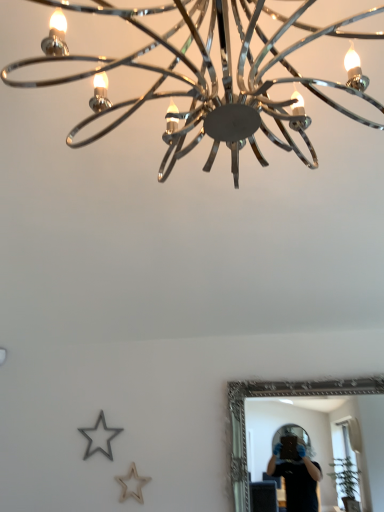
What do you see at coordinates (211, 78) in the screenshot? Image resolution: width=384 pixels, height=512 pixels. I see `chrome/metallic chandelier at upper center` at bounding box center [211, 78].

Locate an element on the screen. chrome/metallic chandelier at upper center is located at coordinates (211, 78).

The image size is (384, 512). What do you see at coordinates (323, 438) in the screenshot? I see `silver/golden metallic mirror at lower right` at bounding box center [323, 438].

Measure the distance between point (381, 395) and camera.

Point (381, 395) and camera are 7.97 feet apart.

The width and height of the screenshot is (384, 512). I want to click on silver/golden metallic mirror at lower right, so click(x=323, y=438).

Find the location of a particular element. The width and height of the screenshot is (384, 512). chrome/metallic chandelier at upper center is located at coordinates (211, 78).

Considering the relative positions of chrome/metallic chandelier at upper center and silver/golden metallic mirror at lower right in the image provided, is chrome/metallic chandelier at upper center to the left or to the right of silver/golden metallic mirror at lower right?

In the image, chrome/metallic chandelier at upper center appears on the left side of silver/golden metallic mirror at lower right.

Considering the positions of objects chrome/metallic chandelier at upper center and silver/golden metallic mirror at lower right in the image provided, who is behind, chrome/metallic chandelier at upper center or silver/golden metallic mirror at lower right?

silver/golden metallic mirror at lower right is further away from the camera.

Is point (29, 64) farther from viewer compared to point (305, 414)?

That is False.

From the image's perspective, is chrome/metallic chandelier at upper center located above or below silver/golden metallic mirror at lower right?

From the image's perspective, chrome/metallic chandelier at upper center appears above silver/golden metallic mirror at lower right.

From a real-world perspective, is chrome/metallic chandelier at upper center below silver/golden metallic mirror at lower right?

No, from a real-world perspective, chrome/metallic chandelier at upper center is not below silver/golden metallic mirror at lower right.

Which of these two, chrome/metallic chandelier at upper center or silver/golden metallic mirror at lower right, is wider?

With larger width is chrome/metallic chandelier at upper center.

In terms of height, does chrome/metallic chandelier at upper center look taller or shorter compared to silver/golden metallic mirror at lower right?

chrome/metallic chandelier at upper center is taller than silver/golden metallic mirror at lower right.

Between chrome/metallic chandelier at upper center and silver/golden metallic mirror at lower right, which one has smaller size?

With smaller size is silver/golden metallic mirror at lower right.

Is chrome/metallic chandelier at upper center surrounding silver/golden metallic mirror at lower right?

That's incorrect, silver/golden metallic mirror at lower right is not inside chrome/metallic chandelier at upper center.

Looking at this image, is chrome/metallic chandelier at upper center not near silver/golden metallic mirror at lower right?

Yes, chrome/metallic chandelier at upper center and silver/golden metallic mirror at lower right are quite far apart.

Consider the image. Is chrome/metallic chandelier at upper center facing towards silver/golden metallic mirror at lower right?

No, chrome/metallic chandelier at upper center is not aimed at silver/golden metallic mirror at lower right.

Find the location of a particular element. Image resolution: width=384 pixels, height=512 pixels. lamp located above the silver/golden metallic mirror at lower right (from the image's perspective) is located at coordinates (211, 78).

Does silver/golden metallic mirror at lower right appear on the left side of chrome/metallic chandelier at upper center?

No.

Does silver/golden metallic mirror at lower right come behind chrome/metallic chandelier at upper center?

That is True.

Which point is more forward, (361, 407) or (263, 102)?

The point (263, 102) is more forward.

From the image's perspective, would you say silver/golden metallic mirror at lower right is positioned over chrome/metallic chandelier at upper center?

No, from the image's perspective, silver/golden metallic mirror at lower right is not on top of chrome/metallic chandelier at upper center.

From a real-world perspective, is silver/golden metallic mirror at lower right positioned under chrome/metallic chandelier at upper center based on gravity?

Yes.

Which object is wider, silver/golden metallic mirror at lower right or chrome/metallic chandelier at upper center?

chrome/metallic chandelier at upper center.

Can you confirm if silver/golden metallic mirror at lower right is shorter than chrome/metallic chandelier at upper center?

Yes, silver/golden metallic mirror at lower right is shorter than chrome/metallic chandelier at upper center.

Which of these two, silver/golden metallic mirror at lower right or chrome/metallic chandelier at upper center, is bigger?

Bigger between the two is chrome/metallic chandelier at upper center.

Is silver/golden metallic mirror at lower right positioned beyond the bounds of chrome/metallic chandelier at upper center?

Yes.

Is silver/golden metallic mirror at lower right not near chrome/metallic chandelier at upper center?

Yes, silver/golden metallic mirror at lower right and chrome/metallic chandelier at upper center are quite far apart.

Is silver/golden metallic mirror at lower right aimed at chrome/metallic chandelier at upper center?

Yes.

Could you measure the distance between silver/golden metallic mirror at lower right and chrome/metallic chandelier at upper center?

They are 6.26 feet apart.

Identify the location of lamp on the left of silver/golden metallic mirror at lower right. pyautogui.click(x=211, y=78).

Locate an element on the screen. This screenshot has height=512, width=384. lamp above the silver/golden metallic mirror at lower right (from a real-world perspective) is located at coordinates (211, 78).

At what (x,y) coordinates should I click in order to perform the action: click on lamp on the left of the silver/golden metallic mirror at lower right. Please return your answer as a coordinate pair (x, y). The height and width of the screenshot is (512, 384). Looking at the image, I should click on (211, 78).